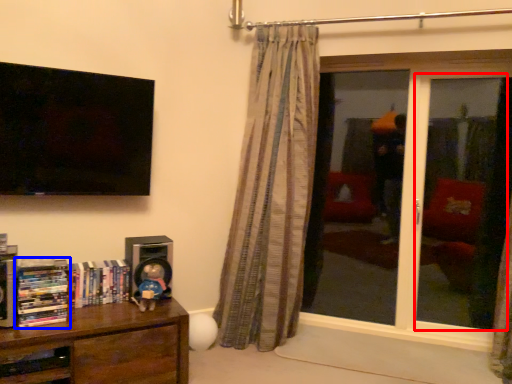
Question: Which object appears farthest to the camera in this image, screen door (highlighted by a red box) or book (highlighted by a blue box)?

Choices:
 (A) screen door
 (B) book

Answer: (A)